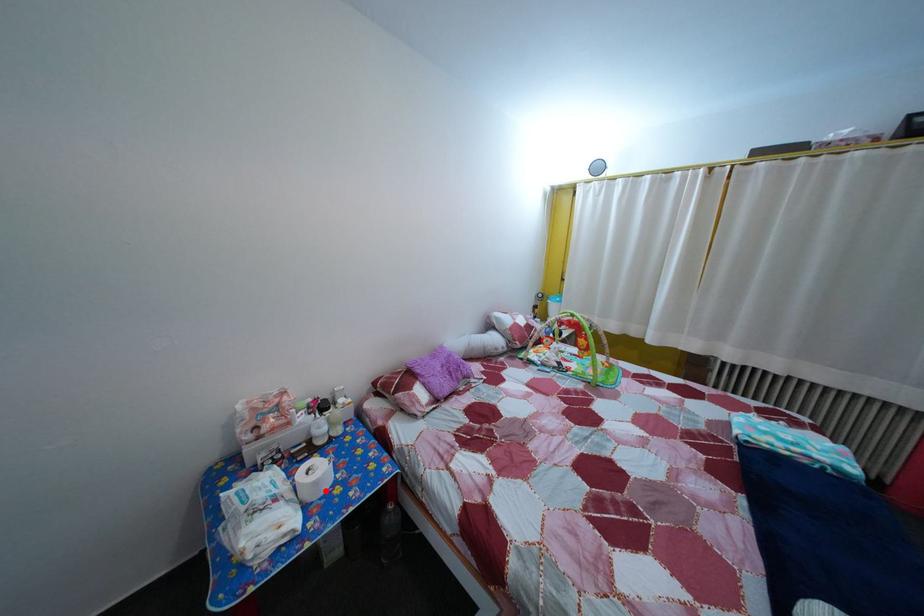
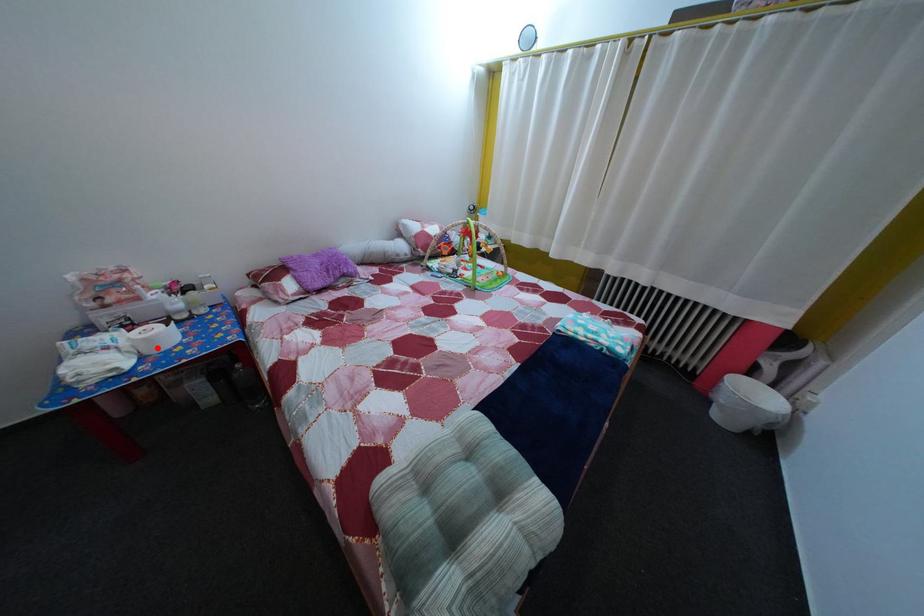
I am providing you with two images of the same scene from different viewpoints. A red point is marked on the first image and another point is marked on the second image. Is the marked point in image1 the same physical position as the marked point in image2?

Yes